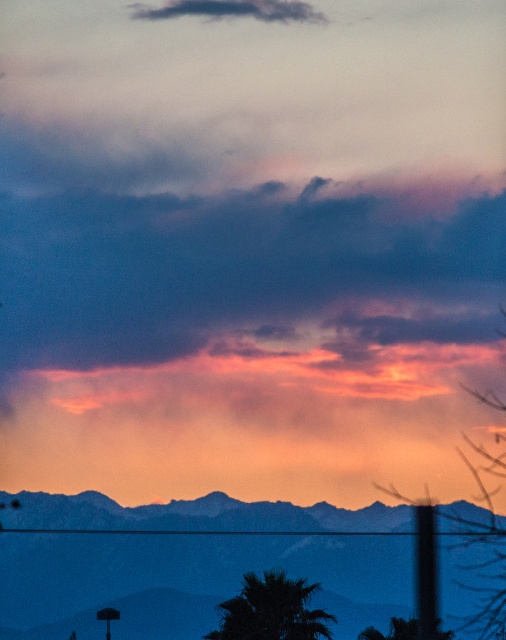
Does dark purple cloud at upper center have a smaller size compared to silvery metallic mountains at center?

Yes.

Who is more distant from viewer, (394, 301) or (24, 547)?

Point (394, 301)

Measure the distance between point (126, 291) and camera.

Point (126, 291) and camera are 1775.86 feet apart from each other.

This screenshot has width=506, height=640. In order to click on dark purple cloud at upper center in this screenshot , I will do pos(243,269).

What do you see at coordinates (193, 515) in the screenshot? This screenshot has width=506, height=640. I see `silhouetted rocky mountains at lower center` at bounding box center [193, 515].

Identify the location of silhouetted rocky mountains at lower center. The height and width of the screenshot is (640, 506). (193, 515).

What do you see at coordinates (193, 515) in the screenshot?
I see `silhouetted rocky mountains at lower center` at bounding box center [193, 515].

The image size is (506, 640). What are the coordinates of `silhouetted rocky mountains at lower center` in the screenshot? It's located at (193, 515).

Between silvery metallic mountains at center and cloudy sky at upper center, which one has more height?

silvery metallic mountains at center

Locate an element on the screen. This screenshot has width=506, height=640. silvery metallic mountains at center is located at coordinates (197, 572).

Which is behind, point (277, 540) or point (193, 4)?

The point (193, 4) is behind.

Where is `silvery metallic mountains at center`? silvery metallic mountains at center is located at coordinates (197, 572).